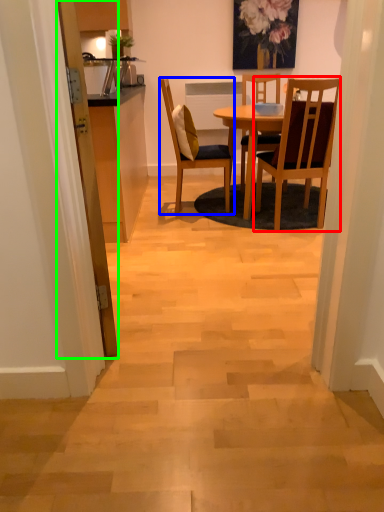
Question: Which is farther away from chair (highlighted by a red box)? chair (highlighted by a blue box) or door (highlighted by a green box)?

Choices:
 (A) chair
 (B) door

Answer: (B)